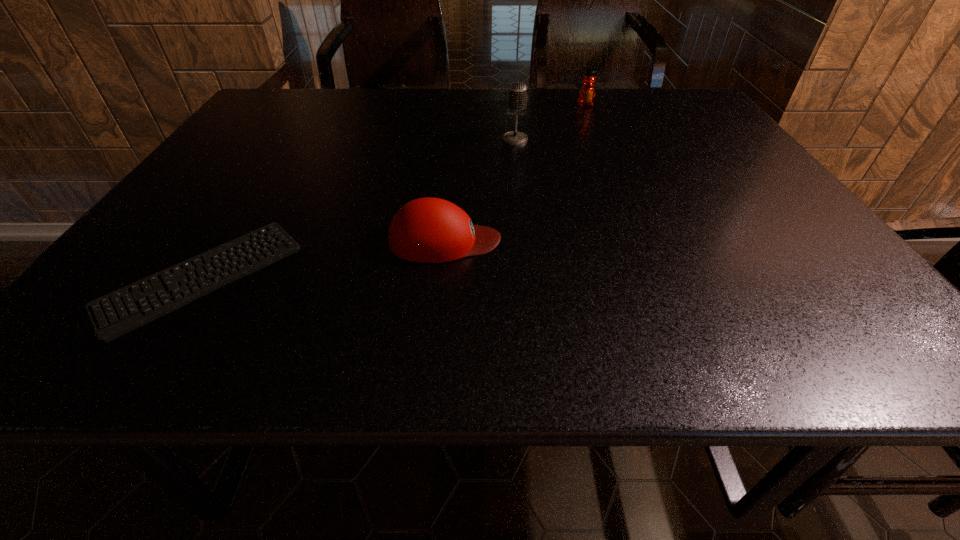
What are the coordinates of `vacant region located on the back of the leftmost object` in the screenshot? It's located at (290, 141).

Where is `object that is at the far edge`? This screenshot has width=960, height=540. object that is at the far edge is located at coordinates (587, 92).

At what (x,y) coordinates should I click in order to perform the action: click on object situated at the near edge. Please return your answer as a coordinate pair (x, y). The width and height of the screenshot is (960, 540). Looking at the image, I should click on (164, 297).

Identify the location of object located at the left edge. (164, 297).

Identify the location of object that is at the near left corner. This screenshot has height=540, width=960. (164, 297).

Locate an element on the screen. This screenshot has width=960, height=540. vacant space at the far edge is located at coordinates (358, 105).

In the image, there is a desktop. Where is `free space at the near edge`? free space at the near edge is located at coordinates (436, 330).

In the image, there is a desktop. Where is `vacant space at the left edge`? vacant space at the left edge is located at coordinates (189, 214).

Where is `vacant point at the right edge`? The image size is (960, 540). vacant point at the right edge is located at coordinates (852, 299).

Identify the location of vacant space at the far left corner of the desktop. (311, 106).